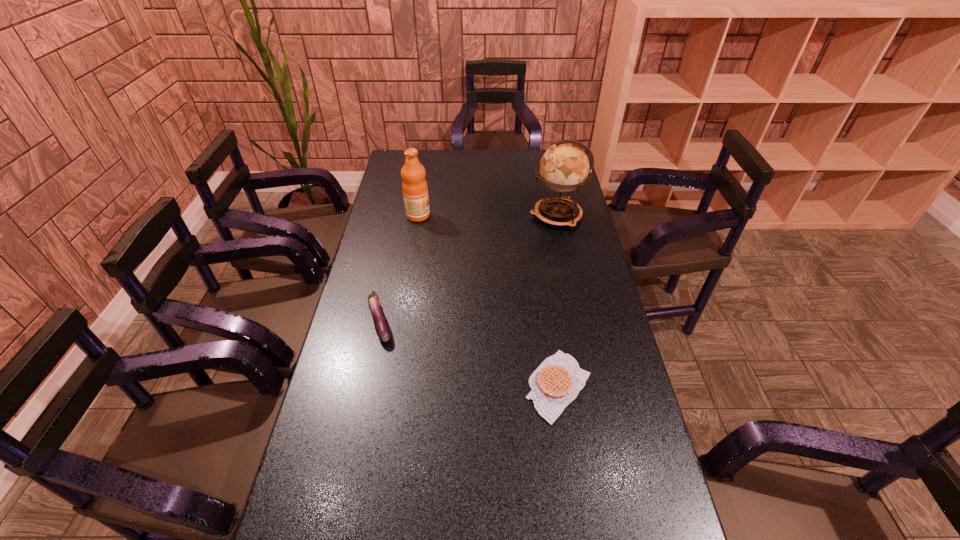
Identify the location of free space that is in between the second nearest object and the globe. (468, 268).

The height and width of the screenshot is (540, 960). What are the coordinates of `free spot between the second tallest object and the shortest object` in the screenshot? It's located at (489, 301).

In order to click on unoccupied area between the tallest object and the fruit juice in this screenshot , I will do coord(488,215).

Where is `unoccupied position between the second tallest object and the second nearest object`? Image resolution: width=960 pixels, height=540 pixels. unoccupied position between the second tallest object and the second nearest object is located at coordinates (399, 268).

Identify the location of empty space between the second tallest object and the pie. Image resolution: width=960 pixels, height=540 pixels. (489, 301).

You are a GUI agent. You are given a task and a screenshot of the screen. Output one action in this format:
    pyautogui.click(x=<x>, y=<y>)
    Task: Click on the free space between the second shortest object and the shortest object
    This screenshot has height=540, width=960.
    Given the screenshot: What is the action you would take?
    pyautogui.click(x=469, y=354)

Identify the location of free spot between the globe and the third shortest object. (488, 215).

The width and height of the screenshot is (960, 540). In order to click on unoccupied position between the third tallest object and the third shortest object in this screenshot , I will do `click(399, 268)`.

The width and height of the screenshot is (960, 540). Identify the location of vacant area between the nearest object and the tallest object. (558, 301).

At what (x,y) coordinates should I click in order to perform the action: click on object that is the third closest one to the eggplant. Please return your answer as a coordinate pair (x, y). This screenshot has height=540, width=960. Looking at the image, I should click on (564, 167).